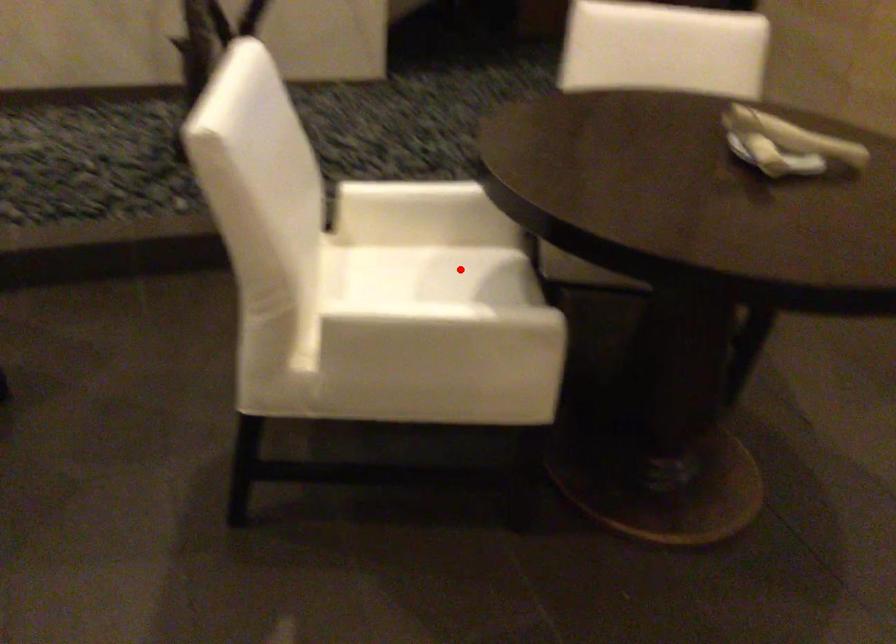
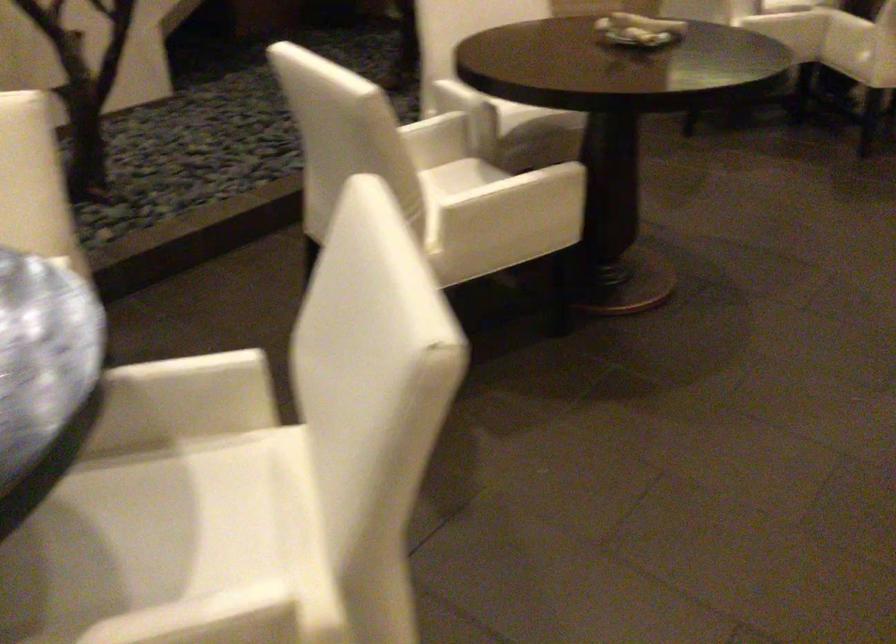
Locate, in the second image, the point that corresponds to the highlighted location in the first image.

(455, 176)